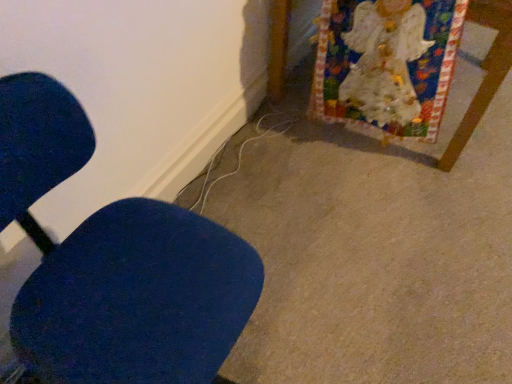
Question: Does point (499, 43) appear closer or farther from the camera than point (122, 254)?

Choices:
 (A) farther
 (B) closer

Answer: (A)

Question: Considering their positions, is white paper at upper right located in front of or behind blue fabric chair at left?

Choices:
 (A) front
 (B) behind

Answer: (B)

Question: From the image's perspective, is white paper at upper right located above or below blue fabric chair at left?

Choices:
 (A) below
 (B) above

Answer: (B)

Question: From the image's perspective, is blue fabric chair at left located above or below white paper at upper right?

Choices:
 (A) above
 (B) below

Answer: (B)

Question: Is point (181, 316) positioned closer to the camera than point (273, 51)?

Choices:
 (A) closer
 (B) farther

Answer: (A)

Question: From their relative heights in the image, would you say blue fabric chair at left is taller or shorter than white paper at upper right?

Choices:
 (A) tall
 (B) short

Answer: (A)

Question: From a real-world perspective, is blue fabric chair at left positioned above or below white paper at upper right?

Choices:
 (A) below
 (B) above

Answer: (B)